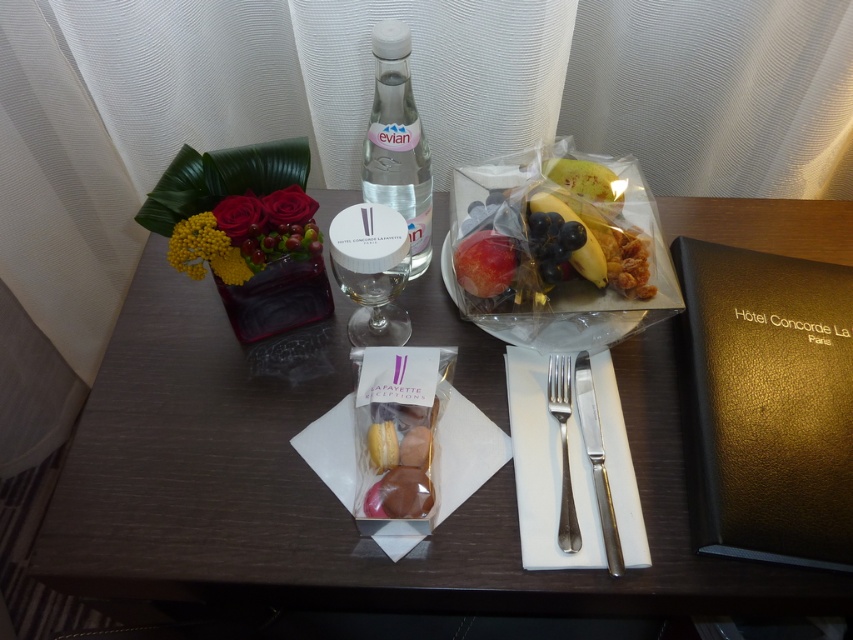
You are setting up a table for a small event and have a wooden table at center and a transparent glass bottle at center. Which object should you place first if you need to ensure there is enough space for both?

The wooden table at center is larger in size than the transparent glass bottle at center, so you should place the wooden table at center first to ensure there is enough space for both.

You are a guest at a hotel and want to eat the fruit from the translucent plastic bag of fruit at center. To do so, you need to reach for the satin silver fork at center. Is the fork in front of or behind the fruit bag?

The satin silver fork at center is behind the translucent plastic bag of fruit at center, so the fork is behind the fruit bag.